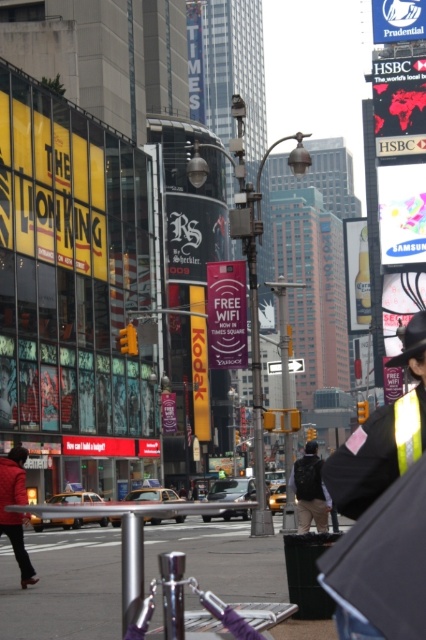
Question: Does red matte jacket at lower left have a greater width compared to dark gray backpack at center?

Choices:
 (A) yes
 (B) no

Answer: (A)

Question: Which point appears farthest from the camera in this image?

Choices:
 (A) (310, 516)
 (B) (408, 403)
 (C) (362, 620)
 (D) (5, 464)

Answer: (A)

Question: Can you confirm if reflective silver jacket at center is positioned to the right of red matte jacket at lower left?

Choices:
 (A) yes
 (B) no

Answer: (A)

Question: Can you confirm if reflective silver jacket at center is positioned below dark gray backpack at center?

Choices:
 (A) yes
 (B) no

Answer: (B)

Question: Which point is closer to the camera taking this photo?

Choices:
 (A) (396, 627)
 (B) (301, 496)

Answer: (A)

Question: Which is farther from the black matte umbrella at lower right?

Choices:
 (A) reflective silver jacket at center
 (B) dark gray backpack at center

Answer: (B)